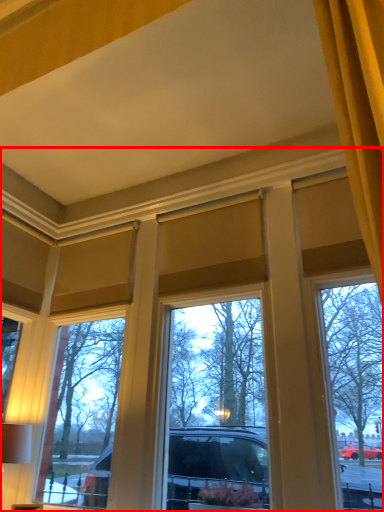
Question: Considering the relative positions of window (annotated by the red box) and table lamp in the image provided, where is window (annotated by the red box) located with respect to the staircase?

Choices:
 (A) left
 (B) right

Answer: (B)